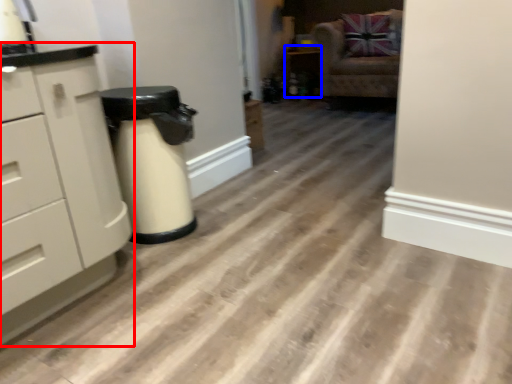
Question: Which point is closer to the camera, chest of drawers (highlighted by a red box) or cabinetry (highlighted by a blue box)?

Choices:
 (A) chest of drawers
 (B) cabinetry

Answer: (A)